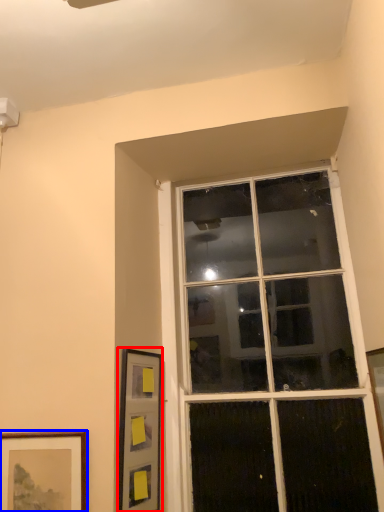
Question: Among these objects, which one is farthest to the camera, picture frame (highlighted by a red box) or picture frame (highlighted by a blue box)?

Choices:
 (A) picture frame
 (B) picture frame

Answer: (A)